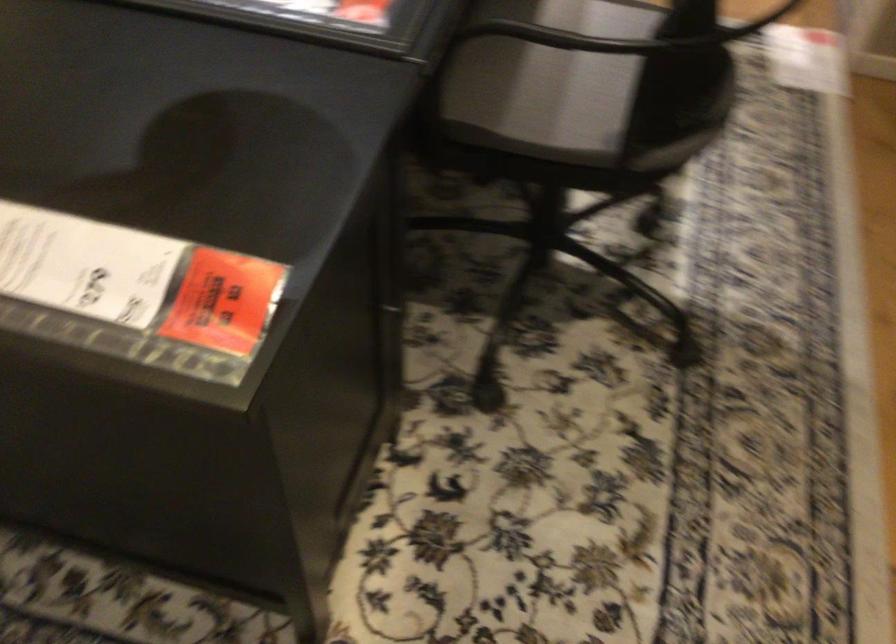
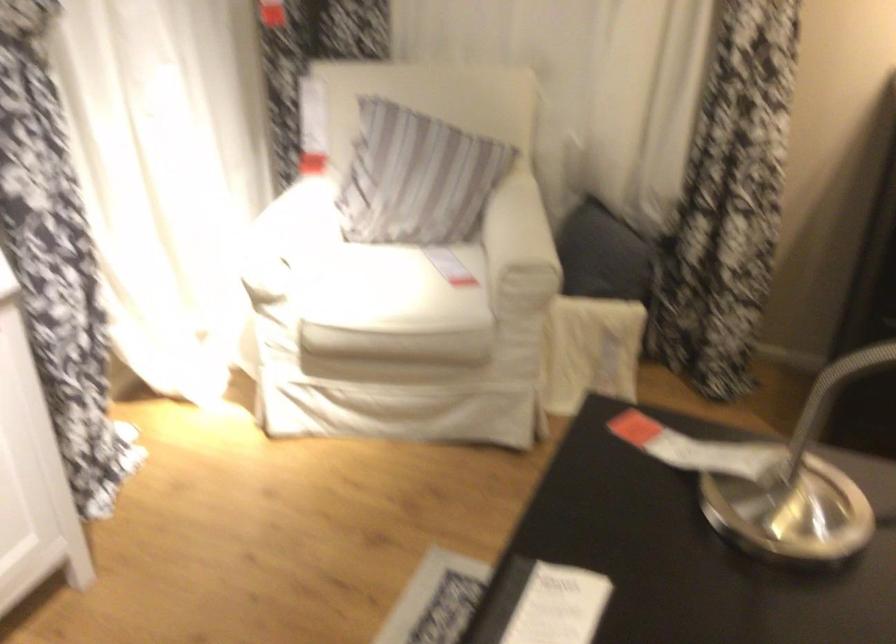
The first image is from the beginning of the video and the second image is from the end. How did the camera likely rotate when shooting the video?

The camera's rotation is toward left-down.